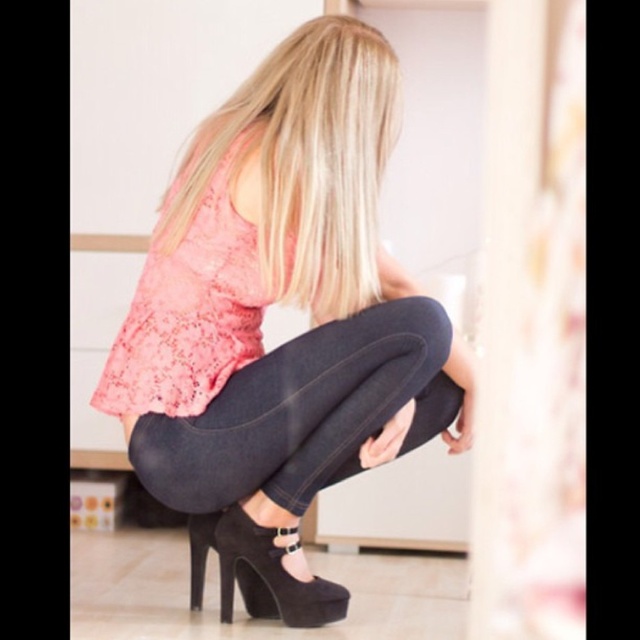
Can you confirm if matte black shoes at center is thinner than blonde smooth hair at center?

Incorrect, matte black shoes at center's width is not less than blonde smooth hair at center's.

Can you confirm if matte black shoes at center is positioned to the right of blonde smooth hair at center?

No, matte black shoes at center is not to the right of blonde smooth hair at center.

Who is more forward, [209,248] or [292,83]?

Point [292,83]

In order to click on matte black shoes at center in this screenshot , I will do `click(289, 340)`.

Is dark denim jeans at center above suede black high-heeled shoe at lower center?

Yes.

Is point (371, 314) more distant than point (202, 544)?

No, (371, 314) is closer to viewer.

Does point (316, 433) come in front of point (246, 563)?

That is True.

At what (x,y) coordinates should I click in order to perform the action: click on dark denim jeans at center. Please return your answer as a coordinate pair (x, y). Looking at the image, I should click on (304, 412).

Does point (244, 104) come closer to viewer compared to point (148, 458)?

No, it is not.

Looking at this image, who is taller, blonde smooth hair at center or dark denim jeans at center?

With more height is blonde smooth hair at center.

Is point (362, 269) in front of point (346, 394)?

Yes, it is.

Find the location of a particular element. This screenshot has width=640, height=640. blonde smooth hair at center is located at coordinates (307, 163).